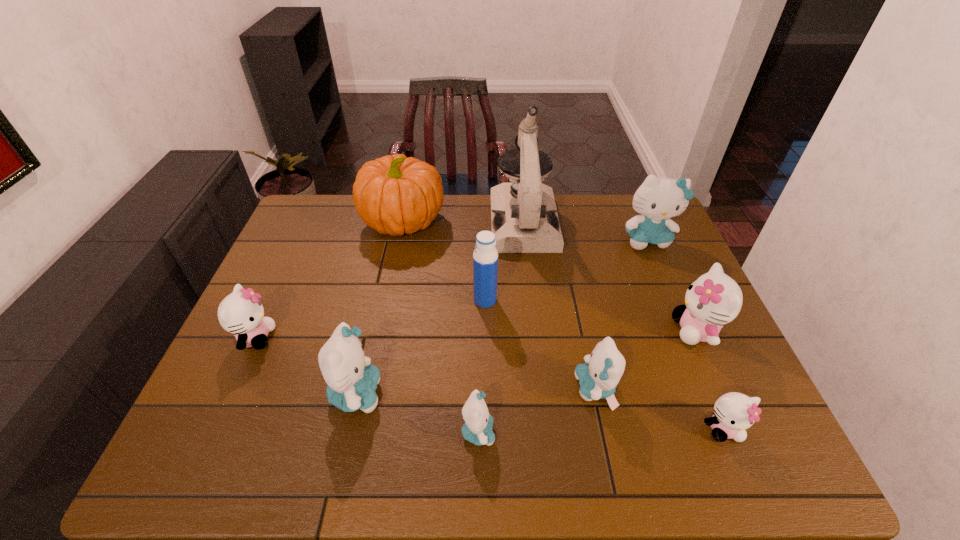
At what (x,y) coordinates should I click in order to perform the action: click on kitten present at the far edge. Please return your answer as a coordinate pair (x, y). The width and height of the screenshot is (960, 540). Looking at the image, I should click on (658, 199).

Identify the location of object at the left edge. This screenshot has height=540, width=960. (241, 313).

Identify the location of object at the far right corner. (658, 199).

You are a GUI agent. You are given a task and a screenshot of the screen. Output one action in this format:
    pyautogui.click(x=<x>, y=<y>)
    Task: Click on the object positioned at the near right corner
    
    Given the screenshot: What is the action you would take?
    pyautogui.click(x=734, y=412)

You are a GUI agent. You are given a task and a screenshot of the screen. Output one action in this format:
    pyautogui.click(x=<x>, y=<y>)
    Task: Click on the vacant space at the far edge
    
    Given the screenshot: What is the action you would take?
    pyautogui.click(x=457, y=201)

The image size is (960, 540). In the image, there is a desktop. In order to click on blank space at the near edge in this screenshot , I will do `click(379, 473)`.

Locate an element on the screen. The height and width of the screenshot is (540, 960). free space at the right edge of the desktop is located at coordinates (758, 431).

I want to click on free space at the near right corner of the desktop, so click(x=742, y=469).

I want to click on free point between the biggest white kitten and the leftmost kitten, so click(476, 334).

Locate an element on the screen. This screenshot has height=540, width=960. vacant region between the pumpkin and the third blue kitten from left to right is located at coordinates (500, 305).